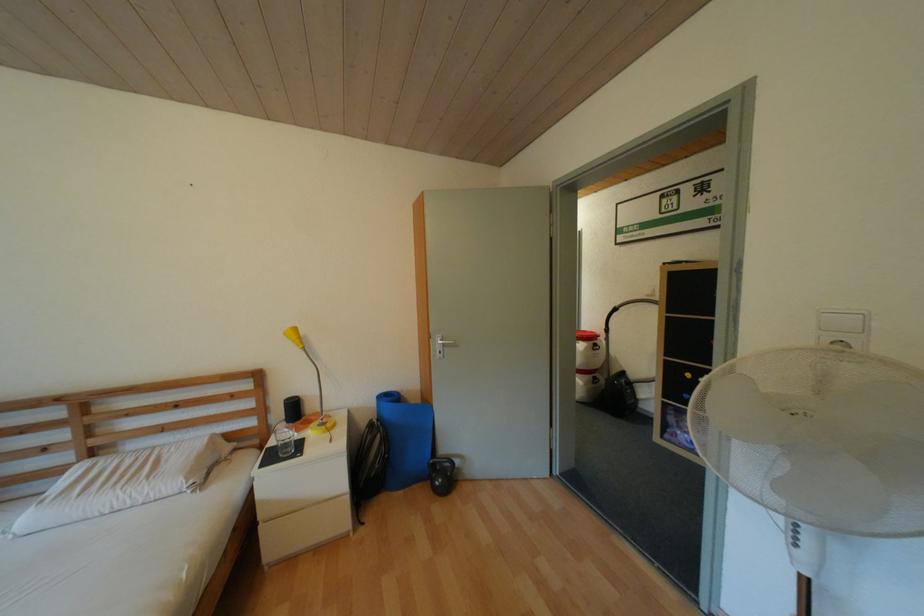
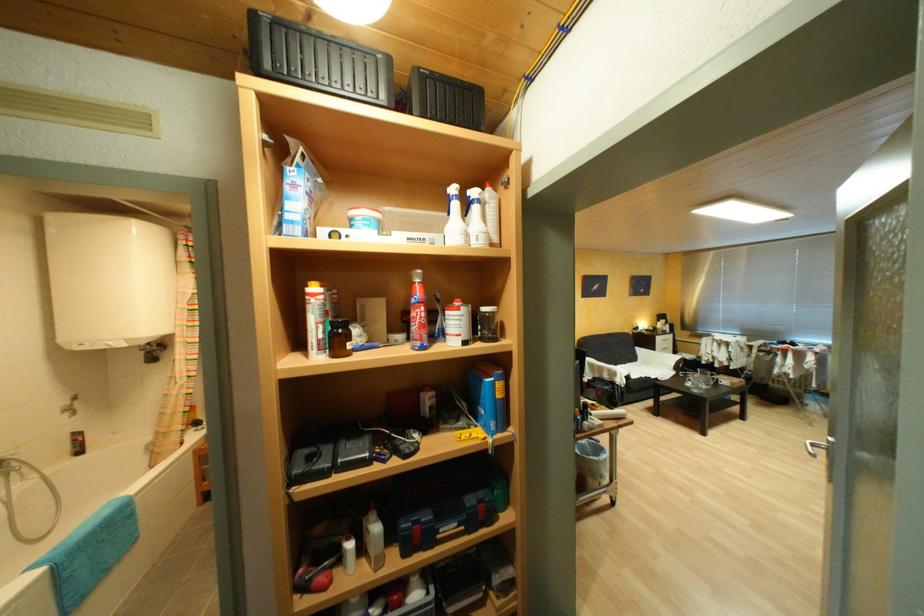
Question: Which direction would the cameraman need to move to produce the second image? Reply with the corresponding letter.

Choices:
 (A) Left
 (B) Right
 (C) Forward
 (D) Backward

Answer: (C)